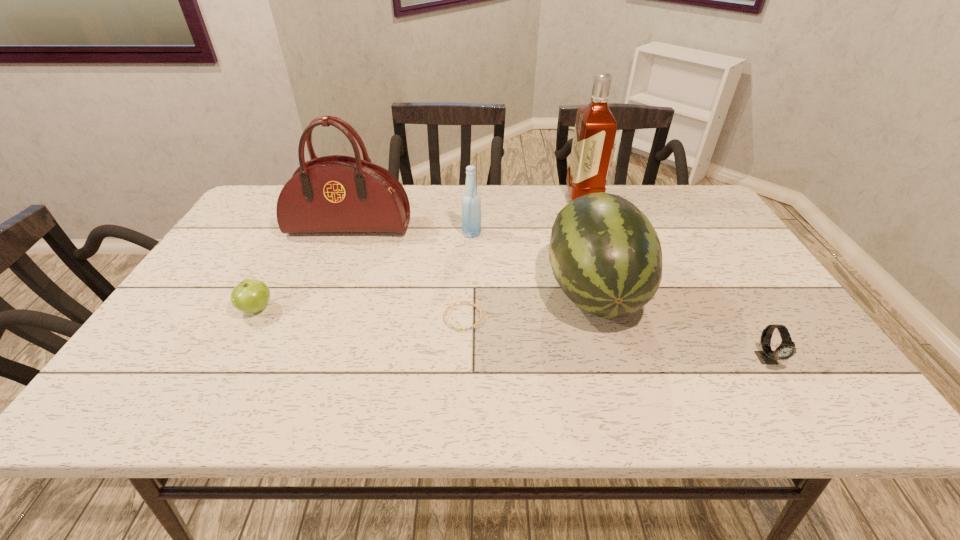
Identify the location of apple located in the left edge section of the desktop. (250, 296).

Locate an element on the screen. The image size is (960, 540). object that is at the right edge is located at coordinates (786, 349).

Find the location of a particular element. The width and height of the screenshot is (960, 540). object present at the far left corner is located at coordinates (331, 194).

Locate an element on the screen. Image resolution: width=960 pixels, height=540 pixels. vacant space at the far edge is located at coordinates (425, 215).

Identify the location of free point at the near edge. (301, 386).

The image size is (960, 540). Identify the location of vacant region at the left edge of the desktop. (219, 267).

At what (x,y) coordinates should I click in order to perform the action: click on blank area at the right edge. Please return your answer as a coordinate pair (x, y). This screenshot has height=540, width=960. Looking at the image, I should click on click(x=812, y=360).

Find the location of a particular element. free region at the far left corner of the desktop is located at coordinates (261, 213).

This screenshot has height=540, width=960. What are the coordinates of `vacant space at the far right corner of the desktop` in the screenshot? It's located at (678, 193).

Find the location of a particular element. This screenshot has height=540, width=960. free space between the rightmost object and the farthest object is located at coordinates (675, 279).